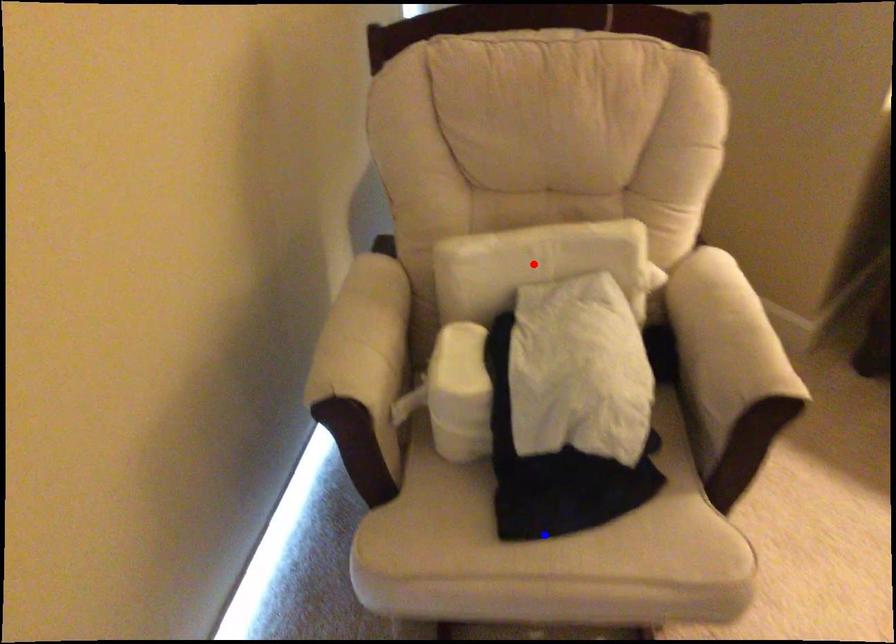
Question: Which of the two points in the image is closer to the camera?

Choices:
 (A) Blue point is closer.
 (B) Red point is closer.

Answer: (A)